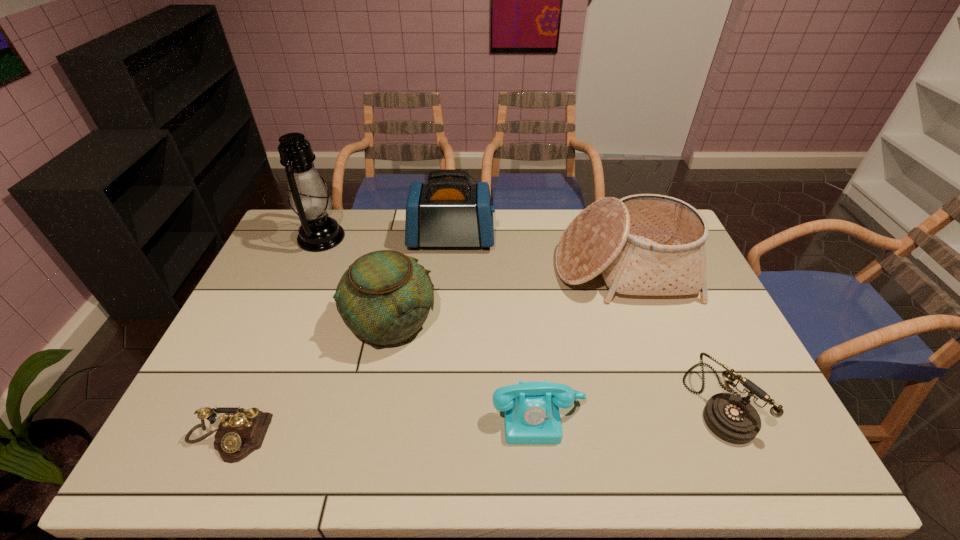
The image size is (960, 540). What are the coordinates of `the tallest object` in the screenshot? It's located at (309, 199).

Where is `toaster`? toaster is located at coordinates (447, 211).

Find the location of a particular element. basket is located at coordinates (646, 244).

Locate an element on the screen. This screenshot has width=960, height=540. the fourth tallest object is located at coordinates (384, 297).

Find the location of a particular element. the second telephone from right to left is located at coordinates (531, 410).

This screenshot has width=960, height=540. Find the location of `the rightmost telephone`. the rightmost telephone is located at coordinates (732, 418).

Identify the location of the leftmost telephone. (242, 431).

Find the location of `free spot located on the front of the oil lamp`. free spot located on the front of the oil lamp is located at coordinates (287, 319).

Find the location of `free point located 0.320m on the front-facing side of the toaster`. free point located 0.320m on the front-facing side of the toaster is located at coordinates (583, 238).

Where is `vacant area situated with the lid open on the basket`? vacant area situated with the lid open on the basket is located at coordinates (640, 320).